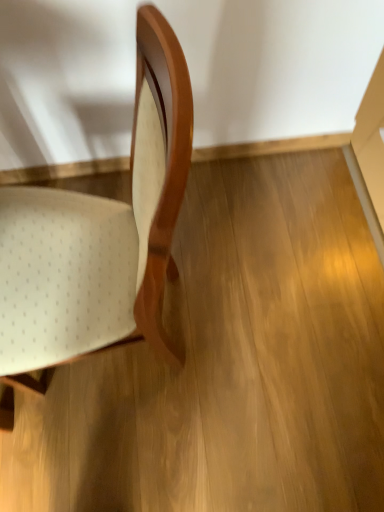
Find the location of `unoccupied area in front of matte white chair at left`. unoccupied area in front of matte white chair at left is located at coordinates (119, 453).